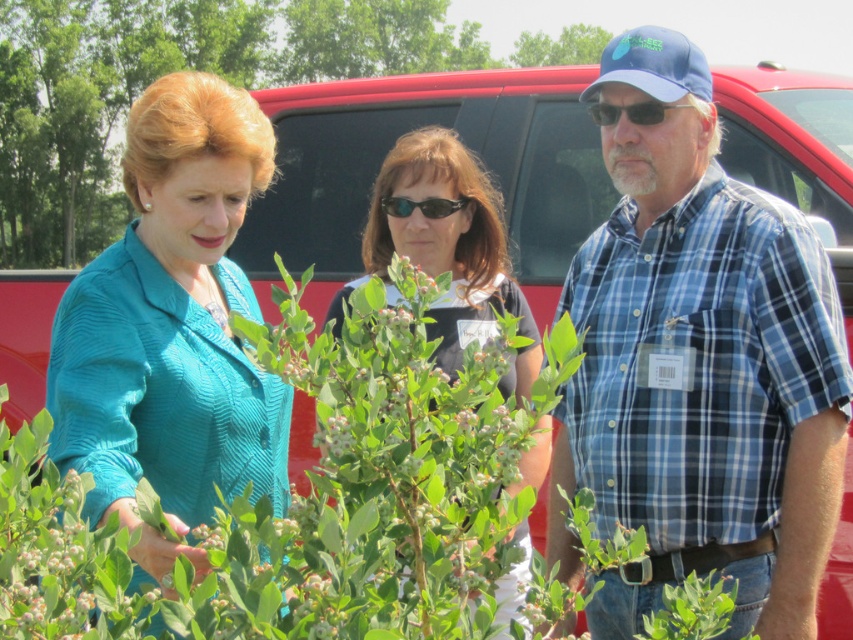
Looking at this image, you are a photographer positioned at the center of the scene. You want to capture a photo that includes both the teal fabric jacket at left and the small blueberry bush in the foreground. Which direction should you move to ensure both are in frame?

The teal fabric jacket at left is positioned at point (172, 321), so moving slightly to the right would center both the jacket and the blueberry bush in the foreground.

You are a photographer taking a picture of the blue plaid shirt at center and the teal fabric jacket at left. Which one will appear closer to the top of the photo?

The blue plaid shirt at center is located above the teal fabric jacket at left, so it will appear closer to the top of the photo.

You are a photographer trying to capture the woman in the teal fabric jacket at left and the sunglasses at center. Which object should you focus on first if you want to start with the one closer to the camera?

The teal fabric jacket at left is to the left of sunglasses at center, so it is closer to the camera. Focus on the teal fabric jacket at left first.